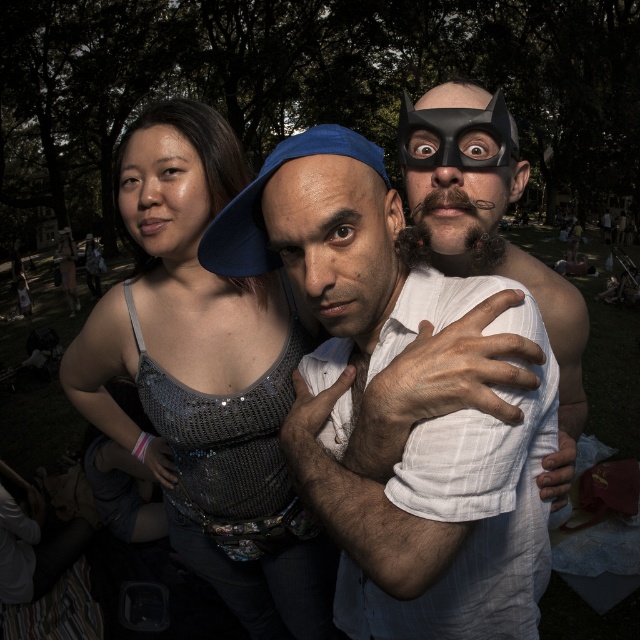
Looking at this image, does white textured shirt at center have a larger size compared to black matte mask at upper center?

Correct, white textured shirt at center is larger in size than black matte mask at upper center.

Is point (305, 243) positioned after point (438, 113)?

No, it is in front of (438, 113).

Locate an element on the screen. The width and height of the screenshot is (640, 640). white textured shirt at center is located at coordinates (412, 429).

Does white textured shirt at center appear on the left side of matte black mask at upper right?

Indeed, white textured shirt at center is positioned on the left side of matte black mask at upper right.

Does point (280, 253) lie behind point (582, 422)?

No.

This screenshot has height=640, width=640. In order to click on white textured shirt at center in this screenshot , I will do `click(412, 429)`.

The image size is (640, 640). Describe the element at coordinates (449, 157) in the screenshot. I see `black matte mask at upper right` at that location.

Does point (426, 192) come farther from viewer compared to point (426, 129)?

Yes, it is behind point (426, 129).

This screenshot has width=640, height=640. I want to click on black matte mask at upper right, so click(x=449, y=157).